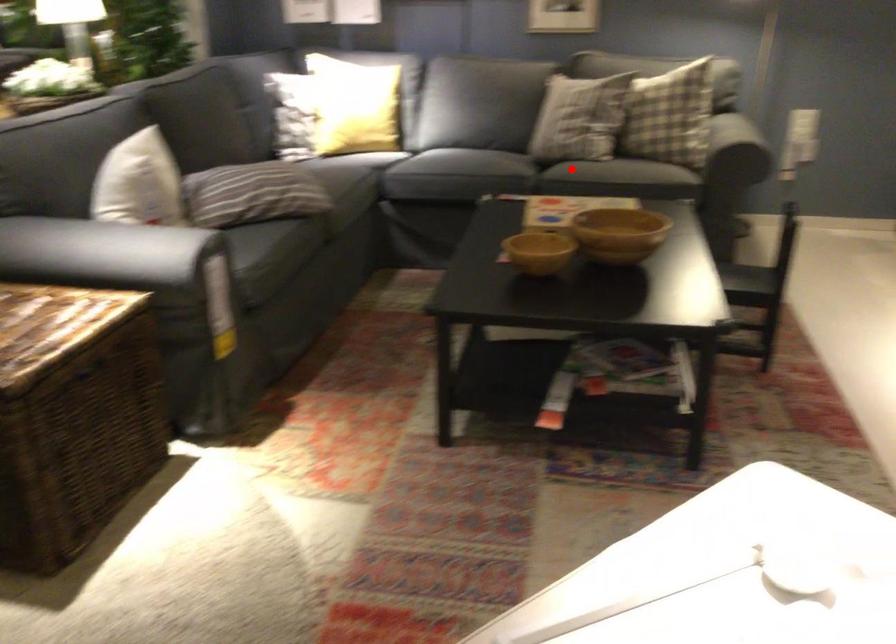
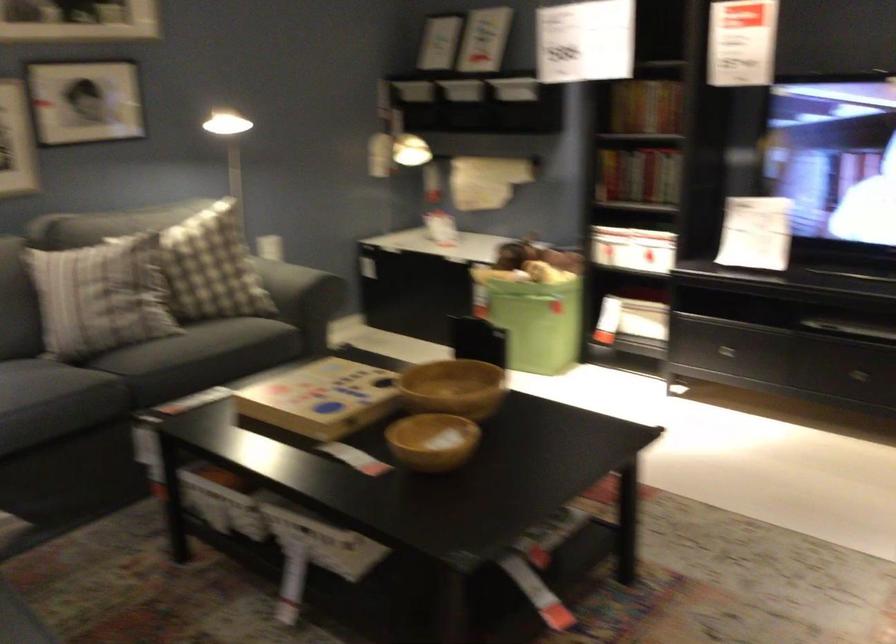
Find the pixel in the second image that matches the highlighted location in the first image.

(199, 357)